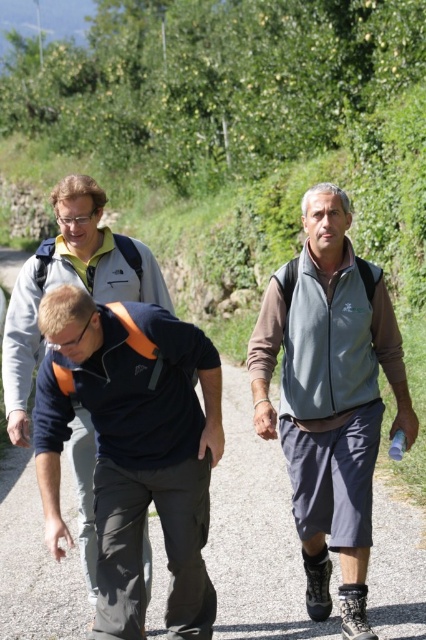
Who is taller, gray fleece vest at center or matte black jacket at center?

matte black jacket at center is taller.

Is point (333, 320) closer to viewer compared to point (43, 292)?

Yes.

Image resolution: width=426 pixels, height=640 pixels. I want to click on gray fleece vest at center, so click(330, 397).

Is dark blue fabric pants at lower left taller than matte black jacket at center?

Incorrect, dark blue fabric pants at lower left's height is not larger of matte black jacket at center's.

Is dark blue fabric pants at lower left above matte black jacket at center?

Correct, dark blue fabric pants at lower left is located above matte black jacket at center.

Is point (118, 368) less distant than point (92, 474)?

Yes, point (118, 368) is in front of point (92, 474).

Where is `dark blue fabric pants at lower left`? dark blue fabric pants at lower left is located at coordinates (132, 449).

Does point (71, 579) come closer to viewer compared to point (394, 422)?

No, it is not.

This screenshot has height=640, width=426. Identify the location of dark blue fabric shirt at center. [x=255, y=532].